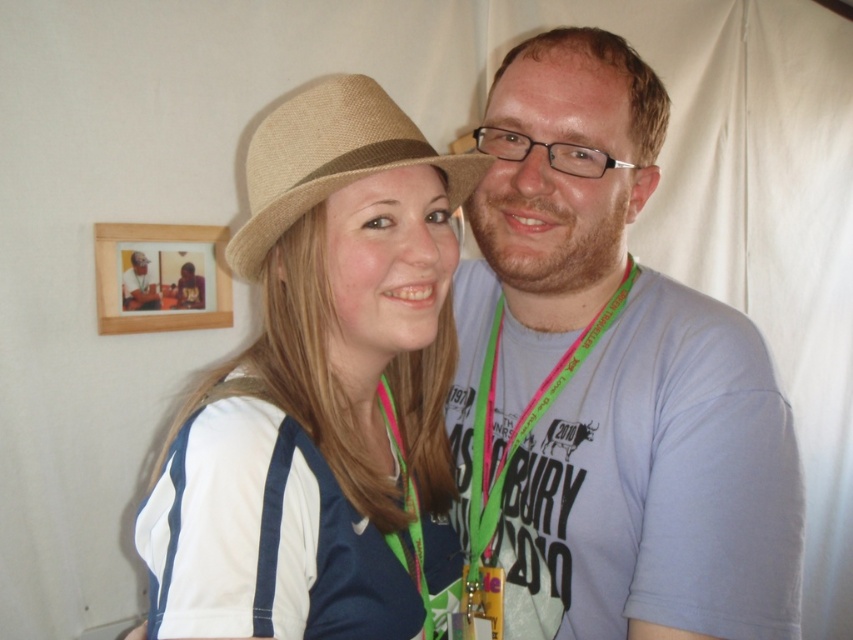
Does matte straw hat at center appear on the left side of beige fabric neck at center?

Indeed, matte straw hat at center is positioned on the left side of beige fabric neck at center.

Does matte straw hat at center have a greater height compared to beige fabric neck at center?

Yes.

Who is more forward, (218, 449) or (515, 280)?

Point (218, 449) is in front.

This screenshot has width=853, height=640. I want to click on matte straw hat at center, so click(x=318, y=396).

The width and height of the screenshot is (853, 640). Describe the element at coordinates (515, 442) in the screenshot. I see `green fabric lanyard at center` at that location.

Does green fabric lanyard at center have a greater width compared to beige fabric neck at center?

Yes.

Is point (473, 490) positioned behind point (526, 305)?

Yes, it is behind point (526, 305).

This screenshot has height=640, width=853. I want to click on green fabric lanyard at center, so click(x=515, y=442).

Is light blue t-shirt at center smaller than matte black hat at upper left?

No, light blue t-shirt at center is not smaller than matte black hat at upper left.

Does light blue t-shirt at center lie in front of matte black hat at upper left?

That is True.

Is point (708, 548) in front of point (129, 301)?

Yes, point (708, 548) is in front of point (129, 301).

At what (x,y) coordinates should I click in order to perform the action: click on light blue t-shirt at center. Please return your answer as a coordinate pair (x, y). This screenshot has height=640, width=853. Looking at the image, I should click on (618, 385).